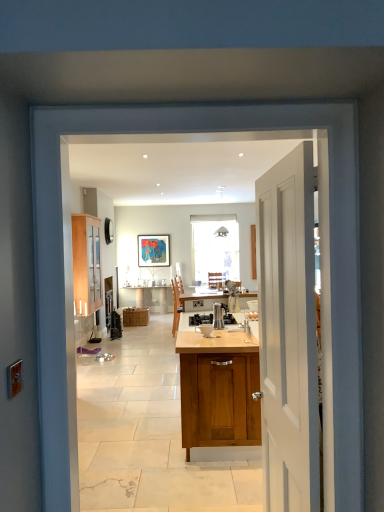
Question: From a real-world perspective, is wooden cabinet at left, placed as the second cabinetry when sorted from bottom to top, under metallic stainless steel coffee maker at center?

Choices:
 (A) yes
 (B) no

Answer: (B)

Question: Is wooden cabinet at left, marked as the second cabinetry in a back-to-front arrangement, looking in the opposite direction of metallic stainless steel coffee maker at center?

Choices:
 (A) yes
 (B) no

Answer: (B)

Question: From the image's perspective, does wooden cabinet at left, which ranks as the 1th cabinetry in front-to-back order, appear lower than metallic stainless steel coffee maker at center?

Choices:
 (A) yes
 (B) no

Answer: (B)

Question: Does wooden cabinet at left, which ranks as the 1th cabinetry in front-to-back order, lie behind metallic stainless steel coffee maker at center?

Choices:
 (A) no
 (B) yes

Answer: (B)

Question: Is wooden cabinet at left, which appears as the 1th cabinetry when viewed from the left, wider than metallic stainless steel coffee maker at center?

Choices:
 (A) yes
 (B) no

Answer: (B)

Question: Considering the positions of woven wicker basket at center, which appears as the first cabinetry when viewed from the right, and metallic stainless steel coffee maker at center in the image, is woven wicker basket at center, which appears as the first cabinetry when viewed from the right, taller or shorter than metallic stainless steel coffee maker at center?

Choices:
 (A) tall
 (B) short

Answer: (A)

Question: From the image's perspective, is woven wicker basket at center, which is the 2th cabinetry from left to right, above or below metallic stainless steel coffee maker at center?

Choices:
 (A) below
 (B) above

Answer: (A)

Question: Looking at their shapes, would you say woven wicker basket at center, which is the 2th cabinetry from left to right, is wider or thinner than metallic stainless steel coffee maker at center?

Choices:
 (A) thin
 (B) wide

Answer: (B)

Question: Considering the positions of woven wicker basket at center, which is the 2th cabinetry from left to right, and metallic stainless steel coffee maker at center in the image, is woven wicker basket at center, which is the 2th cabinetry from left to right, bigger or smaller than metallic stainless steel coffee maker at center?

Choices:
 (A) big
 (B) small

Answer: (A)

Question: In terms of height, does satin silver coffee maker at center look taller or shorter compared to woven wicker basket at center, the 2th cabinetry in the top-to-bottom sequence?

Choices:
 (A) tall
 (B) short

Answer: (B)

Question: Relative to woven wicker basket at center, the 2th cabinetry in the top-to-bottom sequence, is satin silver coffee maker at center in front or behind?

Choices:
 (A) front
 (B) behind

Answer: (A)

Question: From the image's perspective, relative to woven wicker basket at center, the 2th cabinetry in the top-to-bottom sequence, is satin silver coffee maker at center above or below?

Choices:
 (A) below
 (B) above

Answer: (B)

Question: Is satin silver coffee maker at center spatially inside woven wicker basket at center, which is the 2th cabinetry from left to right, or outside of it?

Choices:
 (A) inside
 (B) outside

Answer: (B)

Question: Does point (193, 322) appear closer or farther from the camera than point (92, 227)?

Choices:
 (A) farther
 (B) closer

Answer: (B)

Question: Based on their sizes in the image, would you say metallic stainless steel coffee maker at center is bigger or smaller than wooden cabinet at left, which appears as the 1th cabinetry when viewed from the left?

Choices:
 (A) small
 (B) big

Answer: (A)